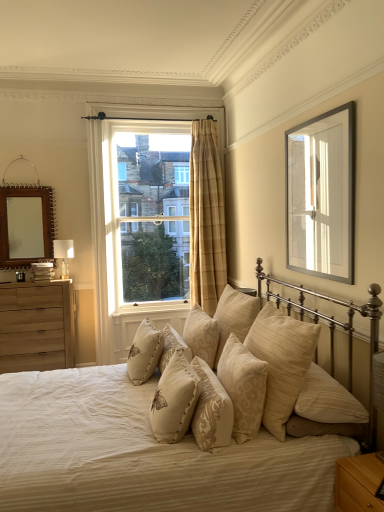
Question: Can you confirm if beige fabric pillow at center, which is the 7th pillow in right-to-left order, is positioned to the left of light brown wood nightstand at lower right?

Choices:
 (A) no
 (B) yes

Answer: (B)

Question: From a real-world perspective, is beige fabric pillow at center, the 2th pillow viewed from the left, beneath light brown wood nightstand at lower right?

Choices:
 (A) no
 (B) yes

Answer: (A)

Question: Is beige fabric pillow at center, which is the 7th pillow in right-to-left order, positioned in front of light brown wood nightstand at lower right?

Choices:
 (A) yes
 (B) no

Answer: (B)

Question: Is beige fabric pillow at center, the 2th pillow viewed from the left, positioned behind light brown wood nightstand at lower right?

Choices:
 (A) yes
 (B) no

Answer: (A)

Question: From a real-world perspective, is beige fabric pillow at center, which is the 7th pillow in right-to-left order, physically above light brown wood nightstand at lower right?

Choices:
 (A) no
 (B) yes

Answer: (B)

Question: Is beige fabric pillow at center, which is the 7th pillow in right-to-left order, at the right side of light brown wood nightstand at lower right?

Choices:
 (A) yes
 (B) no

Answer: (B)

Question: Can you confirm if beige textured pillows at center, which is counted as the 1th pillow, starting from the right, is positioned to the right of wooden mirror at upper left?

Choices:
 (A) no
 (B) yes

Answer: (B)

Question: Can you confirm if beige textured pillows at center, which is counted as the 1th pillow, starting from the right, is positioned to the left of wooden mirror at upper left?

Choices:
 (A) yes
 (B) no

Answer: (B)

Question: Is beige textured pillows at center, which is counted as the 1th pillow, starting from the right, further to camera compared to wooden mirror at upper left?

Choices:
 (A) yes
 (B) no

Answer: (B)

Question: From a real-world perspective, does beige textured pillows at center, the 8th pillow from the left, stand above wooden mirror at upper left?

Choices:
 (A) yes
 (B) no

Answer: (B)

Question: Is beige textured pillows at center, the 8th pillow from the left, bigger than wooden mirror at upper left?

Choices:
 (A) no
 (B) yes

Answer: (B)

Question: Is beige textured pillows at center, the 8th pillow from the left, next to wooden mirror at upper left?

Choices:
 (A) no
 (B) yes

Answer: (A)

Question: Is beige fabric pillow at center, which is the 7th pillow in right-to-left order, located outside beige textured pillow at center, marked as the 5th pillow in a right-to-left arrangement?

Choices:
 (A) yes
 (B) no

Answer: (A)